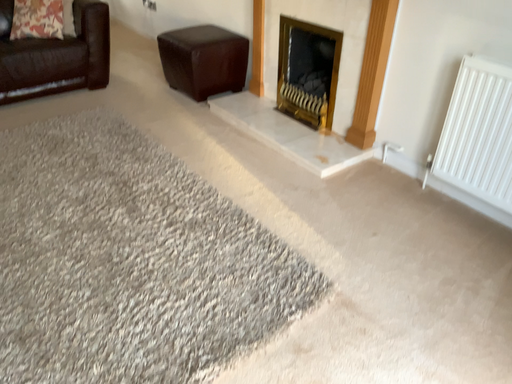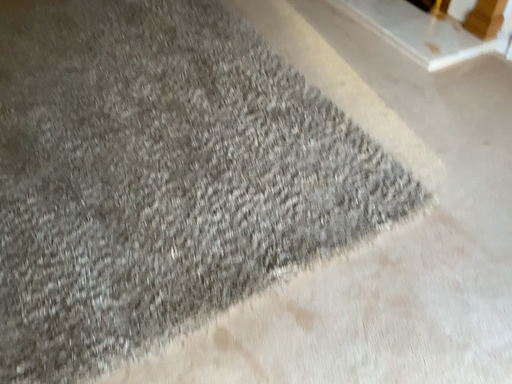
Question: Which way did the camera rotate in the video?

Choices:
 (A) rotated upward
 (B) rotated downward

Answer: (B)